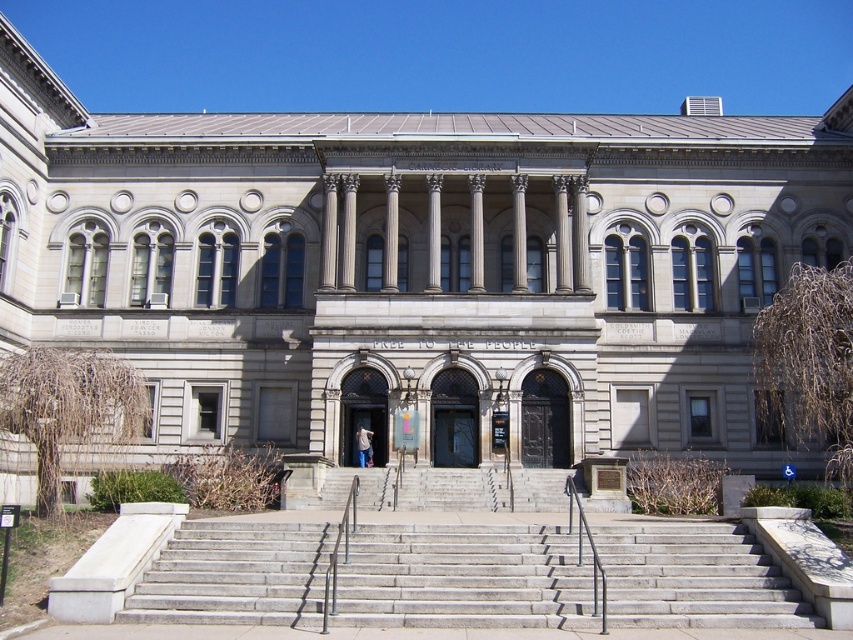
You are standing at the point labeled point (463, 577) in the image. What object are you standing on?

You are standing on the gray concrete stairs at center.

You are a person with a wheelchair who wants to enter the building. The wheelchair is 0.7 meters wide. Are the gray concrete stairs at center and the polished metal railing at center spaced far enough apart to allow the wheelchair to pass through the gap between them?

The gray concrete stairs at center and polished metal railing at center are 6.59 meters apart, so yes, the wheelchair can pass through the gap between them since the distance is wider than the wheelchair width.